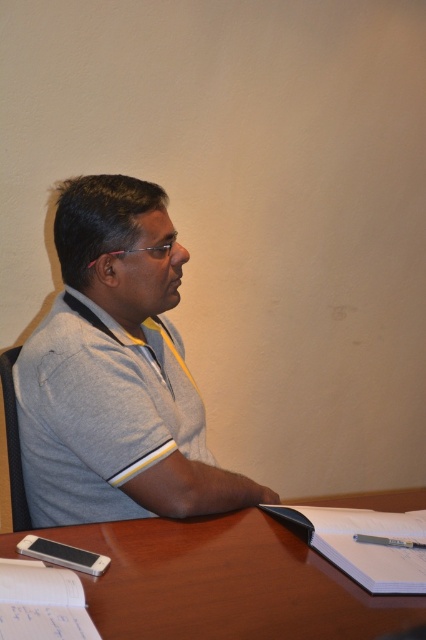
Between brown wooden table at center and white paper at lower right, which one has more height?

Standing taller between the two is brown wooden table at center.

Is brown wooden table at center smaller than white paper at lower right?

Incorrect, brown wooden table at center is not smaller in size than white paper at lower right.

Who is more forward, (186, 628) or (337, 508)?

Point (186, 628)

Identify the location of brown wooden table at center. Image resolution: width=426 pixels, height=640 pixels. (227, 582).

Can you confirm if gray cotton shirt at center is wider than white paper at lower right?

Correct, the width of gray cotton shirt at center exceeds that of white paper at lower right.

Which is behind, point (83, 428) or point (319, 515)?

The point (319, 515) is more distant.

Does point (118, 209) lie behind point (357, 579)?

Yes, it is.

Where is `gray cotton shirt at center`? gray cotton shirt at center is located at coordinates (115, 372).

Does gray cotton shirt at center have a lesser height compared to brown wooden table at center?

In fact, gray cotton shirt at center may be taller than brown wooden table at center.

I want to click on gray cotton shirt at center, so click(x=115, y=372).